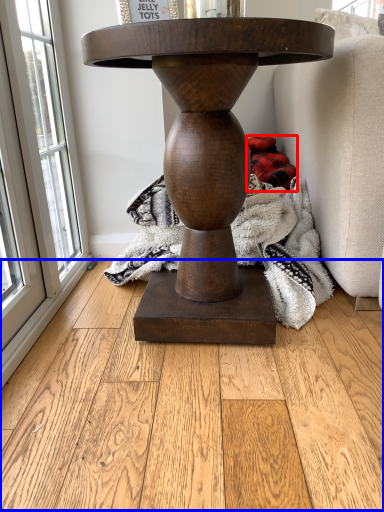
Question: Which point is further to the camera, material (highlighted by a red box) or hardwood (highlighted by a blue box)?

Choices:
 (A) material
 (B) hardwood

Answer: (A)